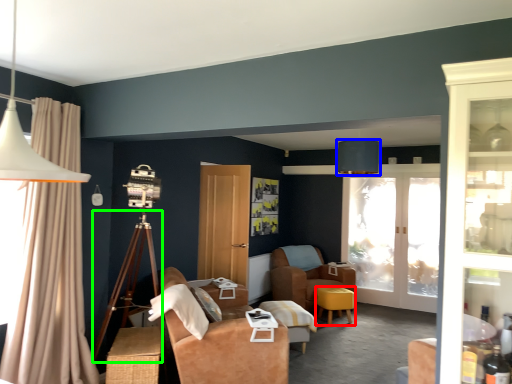
Question: Considering the real-world distances, which object is closest to stool (highlighted by a red box)? table lamp (highlighted by a blue box) or tripod (highlighted by a green box).

Choices:
 (A) table lamp
 (B) tripod

Answer: (A)